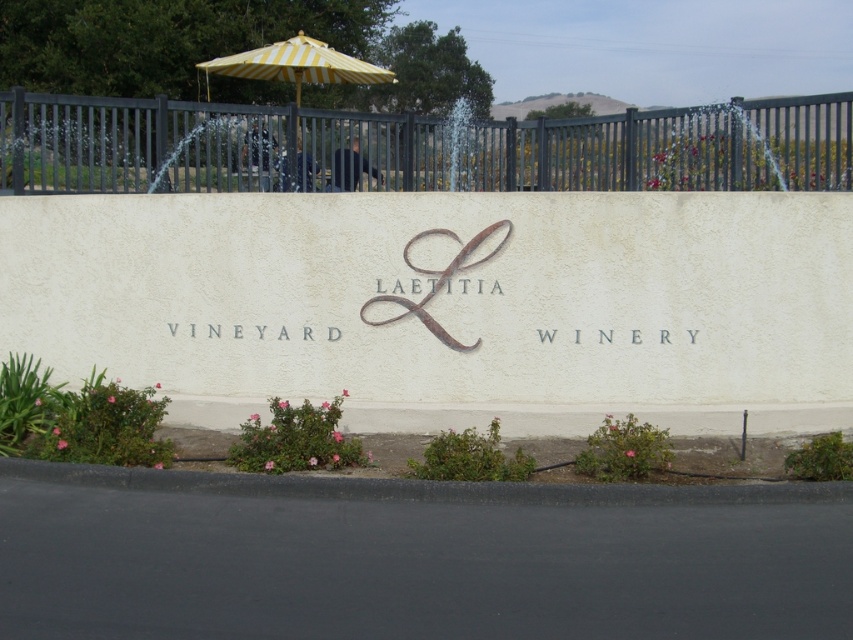
Who is shorter, black metal fence at upper center or yellow striped umbrella at upper center?

Standing shorter between the two is yellow striped umbrella at upper center.

Which is in front, point (126, 102) or point (291, 44)?

Positioned in front is point (126, 102).

Identify the location of black metal fence at upper center. The image size is (853, 640). (416, 147).